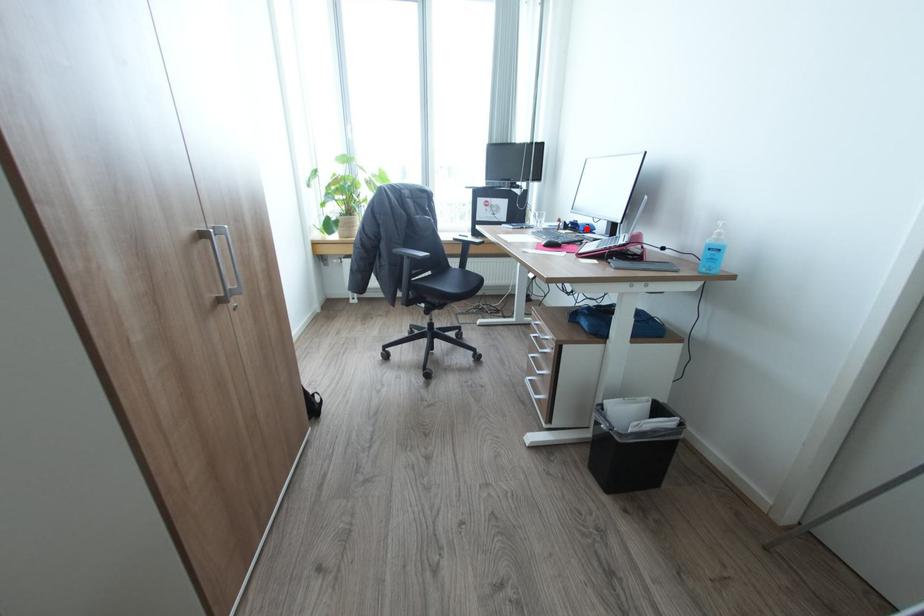
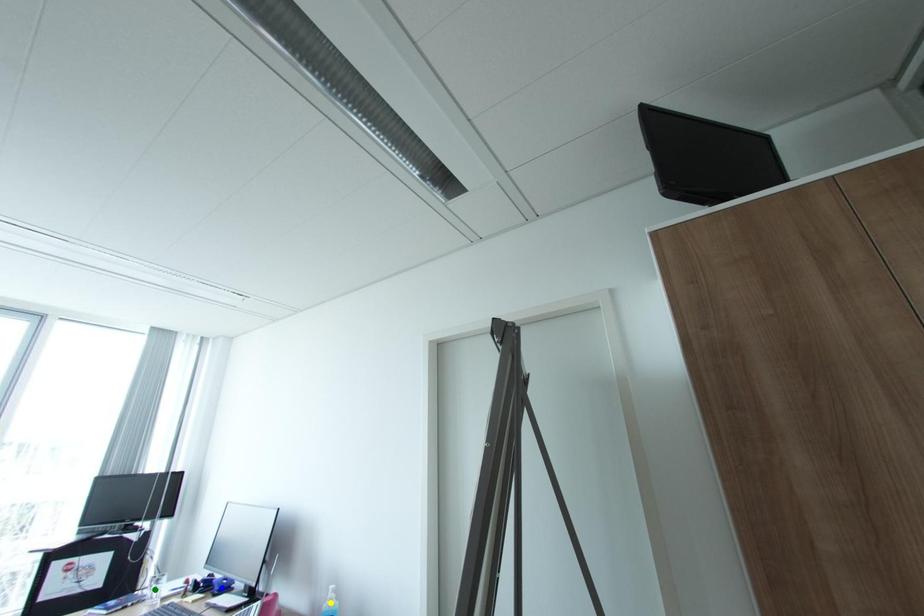
Question: I am providing you with two images of the same scene from different viewpoints. A red point is marked on the first image. You are given multiple points on the second image. Can you choose the point in image 2 that corresponds to the point in image 1?

Choices:
 (A) green point
 (B) yellow point
 (C) blue point

Answer: (C)